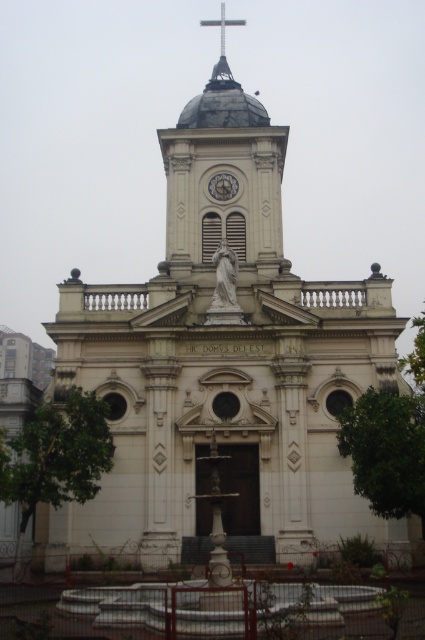
Between point (227, 195) and point (243, 19), which one is positioned in front?

Point (227, 195) is more forward.

Which is below, metallic clock at center or metallic cross at upper center?

metallic clock at center is lower down.

You are a GUI agent. You are given a task and a screenshot of the screen. Output one action in this format:
    pyautogui.click(x=<x>, y=<y>)
    Task: Click on the metallic clock at center
    
    Given the screenshot: What is the action you would take?
    pyautogui.click(x=223, y=186)